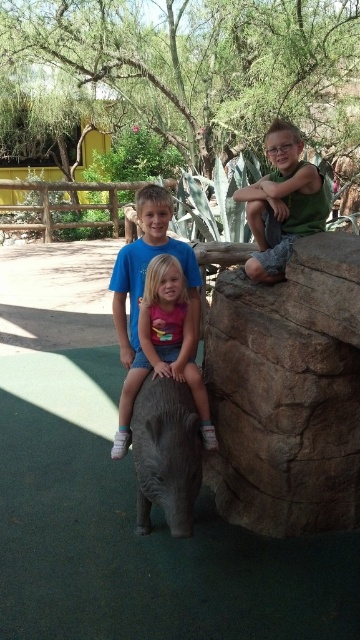
You are a zookeeper who needs to place a 20 inch long fence panel between the brown rough rock at right and the gray matte elephant at center. Can you fit it in the space between them?

The distance between the brown rough rock at right and the gray matte elephant at center is 21.84 inches. Since the fence panel is 20 inches long, it can fit within the space as 21.84 inches is greater than 20 inches.

You are a zookeeper planning to place a new sign at point (288, 392). What object is located at that coordinate?

The point (288, 392) corresponds to the brown rough rock at right.